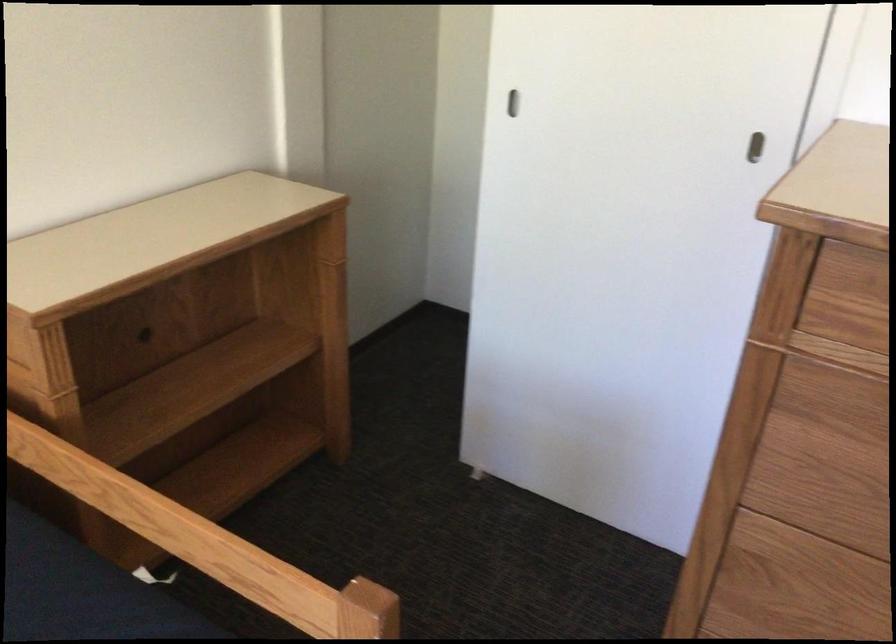
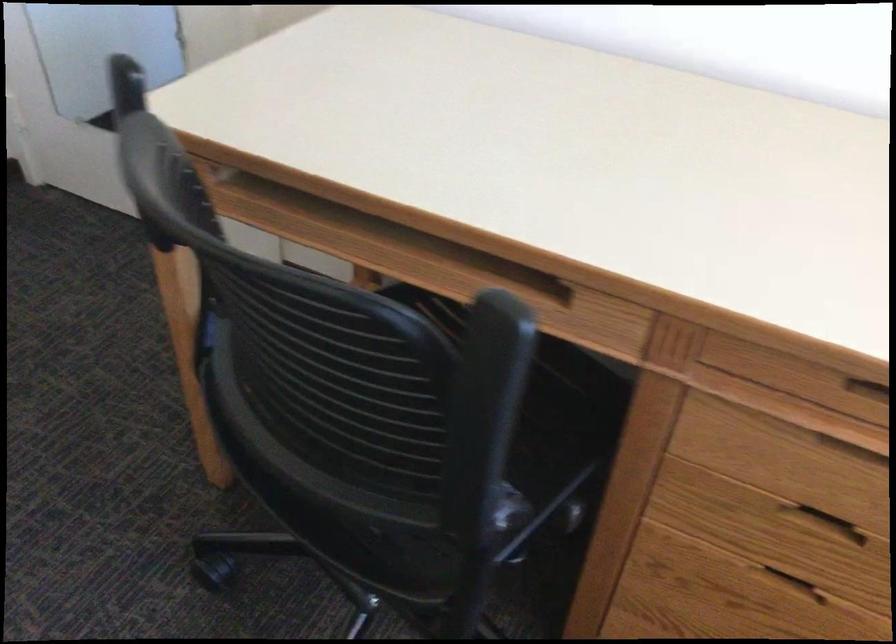
The first image is from the beginning of the video and the second image is from the end. How did the camera likely rotate when shooting the video?

The camera rotated toward right-down.